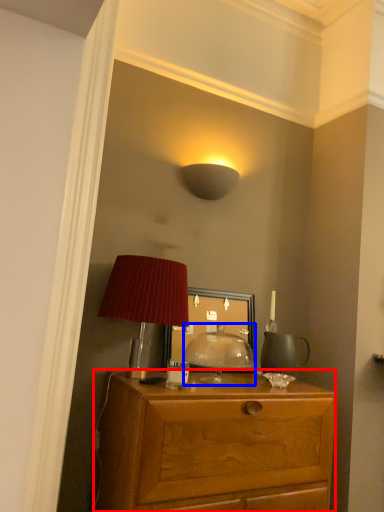
Question: Among these objects, which one is nearest to the camera, desk (highlighted by a red box) or table lamp (highlighted by a blue box)?

Choices:
 (A) desk
 (B) table lamp

Answer: (A)